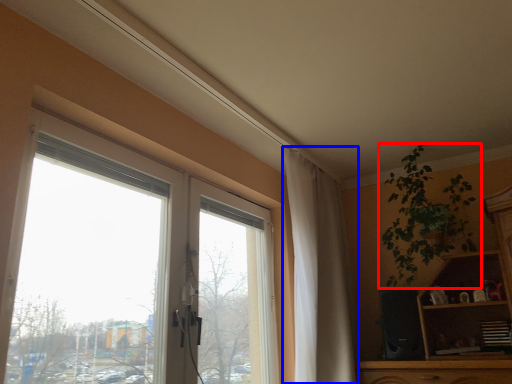
Question: Which point is further to the camera, houseplant (highlighted by a red box) or curtain (highlighted by a blue box)?

Choices:
 (A) houseplant
 (B) curtain

Answer: (A)